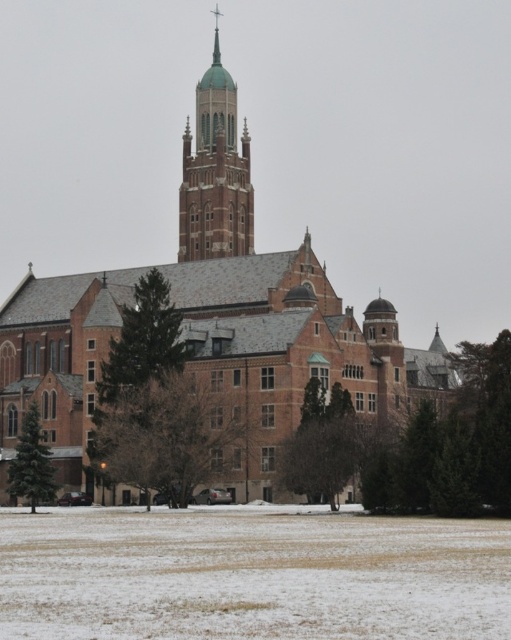
Is green-tiled spire at center positioned before green matte tree at lower left?

No, it is behind green matte tree at lower left.

Between green-tiled spire at center and green matte tree at lower left, which one appears on the left side from the viewer's perspective?

green matte tree at lower left is more to the left.

Between point (181, 241) and point (30, 468), which one is positioned behind?

The point (181, 241) is more distant.

Locate an element on the screen. green-tiled spire at center is located at coordinates (216, 172).

Does point (68, 292) come in front of point (156, 561)?

No, (68, 292) is further to viewer.

Between brick church at center and snowy grass at lower center, which one has more height?

brick church at center

The width and height of the screenshot is (511, 640). In order to click on brick church at center in this screenshot , I will do `click(273, 301)`.

Locate an element on the screen. This screenshot has width=511, height=640. brick church at center is located at coordinates (273, 301).

Who is more distant from viewer, (28, 269) or (174, 324)?

The point (28, 269) is more distant.

Is brick church at center bigger than green textured tree at center-left?

Correct, brick church at center is larger in size than green textured tree at center-left.

Is point (191, 150) farther from viewer compared to point (152, 296)?

Yes, it is.

I want to click on brick church at center, so click(273, 301).